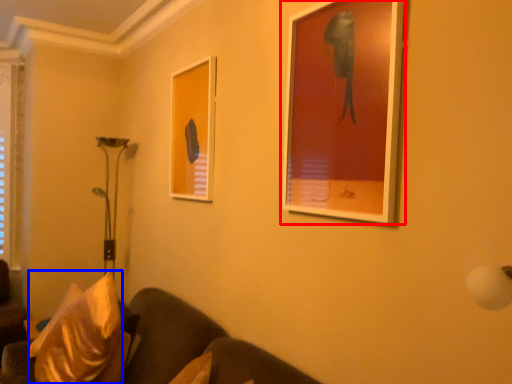
Question: Which object is closer to the camera taking this photo, picture frame (highlighted by a red box) or pillow (highlighted by a blue box)?

Choices:
 (A) picture frame
 (B) pillow

Answer: (A)